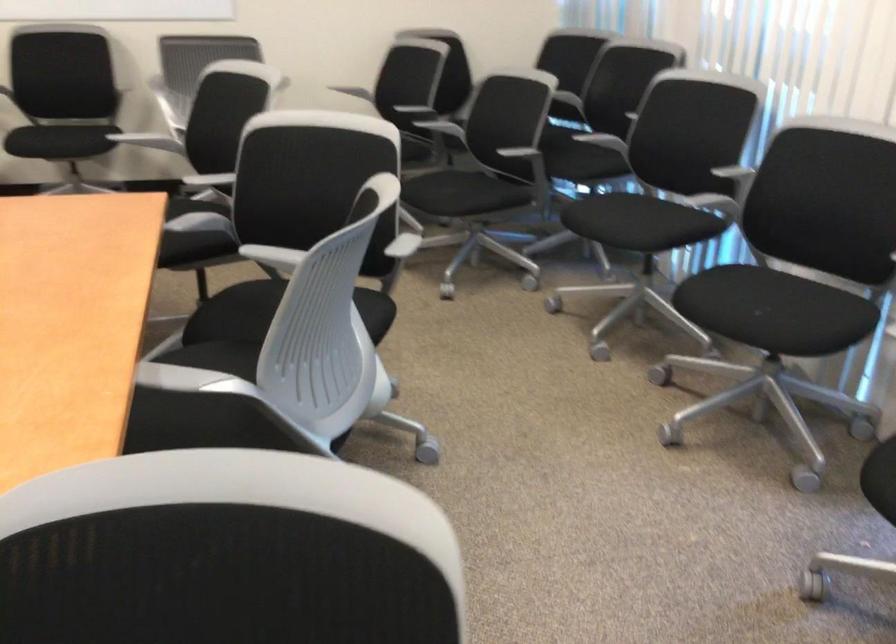
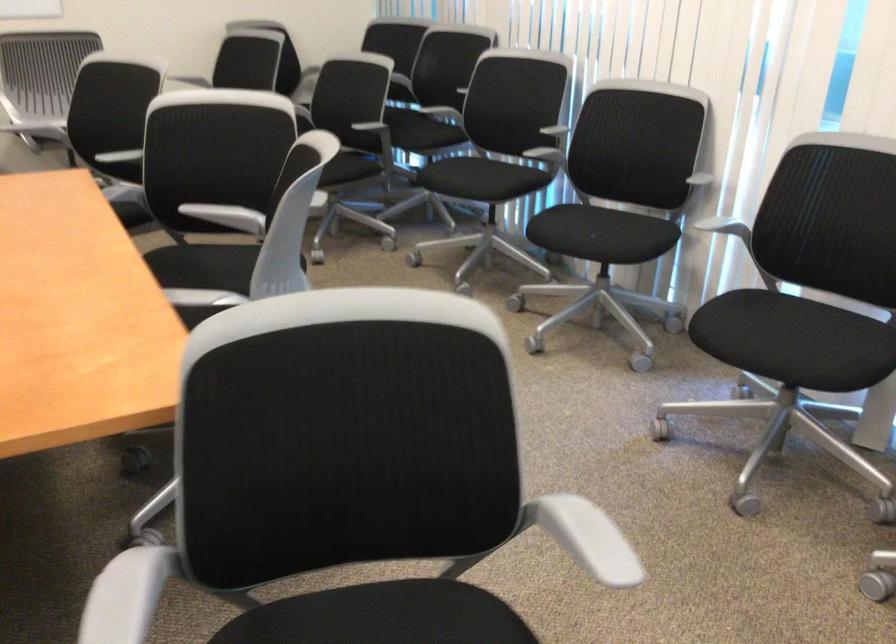
The images are taken continuously from a first-person perspective. In which direction are you moving?

The movement direction of the cameraman is left, backward.